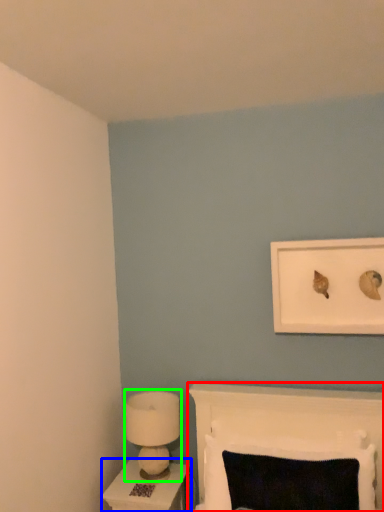
Question: Considering the real-world distances, which object is closest to furniture (highlighted by a red box)? nightstand (highlighted by a blue box) or lamp (highlighted by a green box).

Choices:
 (A) nightstand
 (B) lamp

Answer: (B)